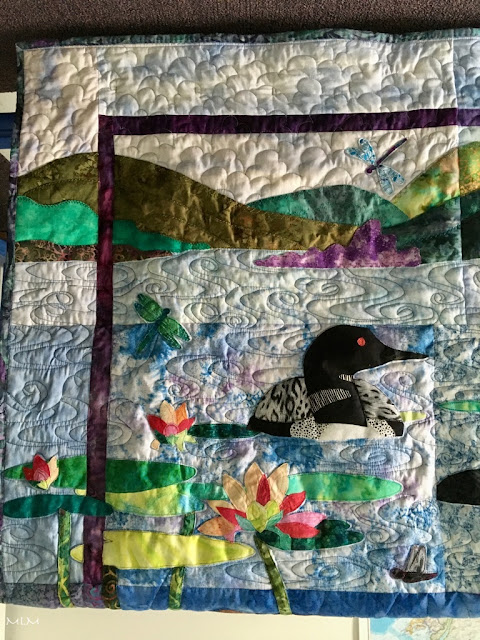
The height and width of the screenshot is (640, 480). In order to click on pink flower petal on flower on quilt in this screenshot , I will do `click(311, 516)`.